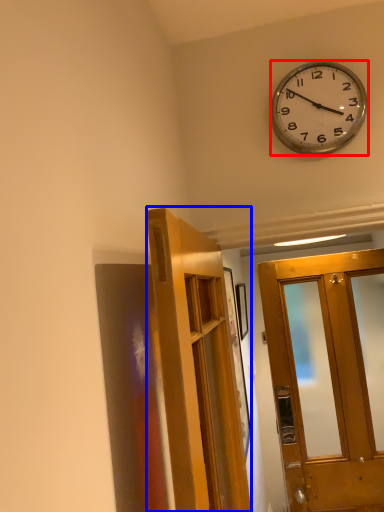
Question: Which object appears farthest to the camera in this image, wall clock (highlighted by a red box) or door (highlighted by a blue box)?

Choices:
 (A) wall clock
 (B) door

Answer: (A)